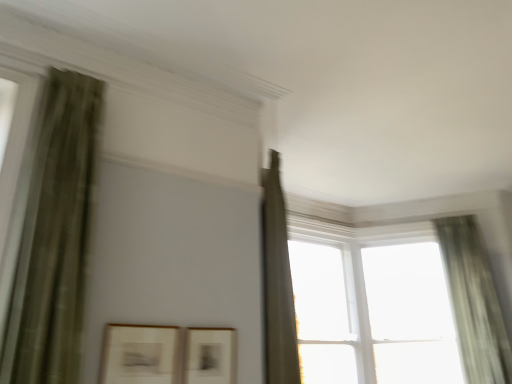
What do you see at coordinates (410, 314) in the screenshot?
I see `transparent glass window at upper right, which is the second window from left to right` at bounding box center [410, 314].

Find the location of a particular element. This screenshot has width=512, height=384. green sheer curtain at right, which is the 1th curtain from right to left is located at coordinates (474, 301).

In order to face green sheer curtain at right, the 2th curtain from the front, should I rotate leftwards or rightwards?

Turn right approximately 27.333 degrees to face it.

I want to click on transparent glass window at upper right, marked as the 1th window in a right-to-left arrangement, so click(x=475, y=300).

What do you see at coordinates (168, 355) in the screenshot? I see `matte white picture frame at lower left, marked as the 1th picture frame in a left-to-right arrangement` at bounding box center [168, 355].

In order to face matte black picture frame at center, the 2th picture frame when ordered from left to right, should I rotate leftwards or rightwards?

You should look left and rotate roughly 5.813 degrees.

Locate an element on the screen. transparent glass window at upper right, the 2th window in the right-to-left sequence is located at coordinates (410, 314).

Is green sheer curtain at right, arranged as the 2th curtain when viewed from the left, aimed at green textured curtain at left, the 1th curtain positioned from the front?

No, green sheer curtain at right, arranged as the 2th curtain when viewed from the left, is not aimed at green textured curtain at left, the 1th curtain positioned from the front.

Is green sheer curtain at right, arranged as the 2th curtain when viewed from the left, next to green textured curtain at left, the 1th curtain positioned from the front?

green sheer curtain at right, arranged as the 2th curtain when viewed from the left, is not next to green textured curtain at left, the 1th curtain positioned from the front, and they're not touching.

From the image's perspective, does green sheer curtain at right, which appears as the first curtain when viewed from the back, appear lower than green textured curtain at left, which is counted as the first curtain, starting from the left?

Yes, from the image's perspective, green sheer curtain at right, which appears as the first curtain when viewed from the back, is beneath green textured curtain at left, which is counted as the first curtain, starting from the left.

Which is behind, green sheer curtain at right, arranged as the 2th curtain when viewed from the left, or green textured curtain at left, the 1th curtain positioned from the front?

green sheer curtain at right, arranged as the 2th curtain when viewed from the left, is further away from the camera.

Is matte white picture frame at lower left, the 2th picture frame from the right, wider or thinner than transparent glass window at upper right, marked as the 1th window in a right-to-left arrangement?

Considering their sizes, matte white picture frame at lower left, the 2th picture frame from the right, looks slimmer than transparent glass window at upper right, marked as the 1th window in a right-to-left arrangement.

Measure the distance between matte white picture frame at lower left, marked as the 1th picture frame in a left-to-right arrangement, and transparent glass window at upper right, the 3th window in the left-to-right sequence.

matte white picture frame at lower left, marked as the 1th picture frame in a left-to-right arrangement, is 3.06 meters away from transparent glass window at upper right, the 3th window in the left-to-right sequence.

Is point (224, 347) farther from camera compared to point (278, 315)?

No, it is in front of (278, 315).

Which object is further away from the camera taking this photo, matte white picture frame at lower left, the 2th picture frame from the right, or transparent glass window at upper right, the 3th window in the left-to-right sequence?

transparent glass window at upper right, the 3th window in the left-to-right sequence, is further away from the camera.

Is matte white picture frame at lower left, marked as the 1th picture frame in a left-to-right arrangement, inside matte black picture frame at center, which ranks as the 1th picture frame in right-to-left order?

No, matte white picture frame at lower left, marked as the 1th picture frame in a left-to-right arrangement, is located outside of matte black picture frame at center, which ranks as the 1th picture frame in right-to-left order.

From a real-world perspective, between matte black picture frame at center, which ranks as the 1th picture frame in right-to-left order, and matte white picture frame at lower left, marked as the 1th picture frame in a left-to-right arrangement, who is vertically higher?

From a 3D spatial view, matte white picture frame at lower left, marked as the 1th picture frame in a left-to-right arrangement, is above.

Does matte black picture frame at center, which ranks as the 1th picture frame in right-to-left order, appear on the left side of matte white picture frame at lower left, marked as the 1th picture frame in a left-to-right arrangement?

No, matte black picture frame at center, which ranks as the 1th picture frame in right-to-left order, is not to the left of matte white picture frame at lower left, marked as the 1th picture frame in a left-to-right arrangement.

From the image's perspective, between matte black picture frame at center, the 2th picture frame when ordered from left to right, and matte white picture frame at lower left, the 2th picture frame from the right, which one is located above?

From the image's view, matte white picture frame at lower left, the 2th picture frame from the right, is above.

From the image's perspective, relative to transparent glass window at upper right, marked as the 1th window in a right-to-left arrangement, is transparent glass window at upper right, which is the second window from left to right, above or below?

From the image's perspective, transparent glass window at upper right, which is the second window from left to right, appears below transparent glass window at upper right, marked as the 1th window in a right-to-left arrangement.

Which of these two, transparent glass window at upper right, the 2th window in the right-to-left sequence, or transparent glass window at upper right, the 3th window in the left-to-right sequence, stands shorter?

With less height is transparent glass window at upper right, the 2th window in the right-to-left sequence.

Is transparent glass window at upper right, the 3th window in the left-to-right sequence, inside transparent glass window at upper right, the 2th window in the right-to-left sequence?

Absolutely, transparent glass window at upper right, the 3th window in the left-to-right sequence, is inside transparent glass window at upper right, the 2th window in the right-to-left sequence.

Based on the photo, relative to white glass window at center, the third window when ordered from right to left, is matte white picture frame at lower left, the 2th picture frame from the right, in front or behind?

In the image, matte white picture frame at lower left, the 2th picture frame from the right, appears in front of white glass window at center, the third window when ordered from right to left.

From a real-world perspective, which is physically below, matte white picture frame at lower left, marked as the 1th picture frame in a left-to-right arrangement, or white glass window at center, which is counted as the first window, starting from the left?

From a 3D spatial view, matte white picture frame at lower left, marked as the 1th picture frame in a left-to-right arrangement, is below.

Is matte white picture frame at lower left, the 2th picture frame from the right, turned away from white glass window at center, which is counted as the first window, starting from the left?

No, matte white picture frame at lower left, the 2th picture frame from the right, is not facing the opposite direction of white glass window at center, which is counted as the first window, starting from the left.

How different are the orientations of transparent glass window at upper right, the 3th window in the left-to-right sequence, and transparent glass window at upper right, which is the second window from left to right, in degrees?

They differ by 1.1 degrees in their facing directions.

Who is more distant, transparent glass window at upper right, marked as the 1th window in a right-to-left arrangement, or transparent glass window at upper right, which is the second window from left to right?

transparent glass window at upper right, which is the second window from left to right, is further away from the camera.

In the scene shown: From the image's perspective, which is below, transparent glass window at upper right, the 3th window in the left-to-right sequence, or transparent glass window at upper right, which is the second window from left to right?

From the image's view, transparent glass window at upper right, which is the second window from left to right, is below.

Is transparent glass window at upper right, marked as the 1th window in a right-to-left arrangement, wider than transparent glass window at upper right, the 2th window in the right-to-left sequence?

No.

Is green textured curtain at left, which is counted as the 2th curtain, starting from the back, thinner than transparent glass window at upper right, marked as the 1th window in a right-to-left arrangement?

No.

Which object is closer to the camera, green textured curtain at left, which is counted as the first curtain, starting from the left, or transparent glass window at upper right, the 3th window in the left-to-right sequence?

green textured curtain at left, which is counted as the first curtain, starting from the left, is more forward.

Is green textured curtain at left, which is the 2th curtain from right to left, spatially inside transparent glass window at upper right, the 3th window in the left-to-right sequence, or outside of it?

green textured curtain at left, which is the 2th curtain from right to left, exists outside the volume of transparent glass window at upper right, the 3th window in the left-to-right sequence.

Which point is more forward, (59, 185) or (272, 278)?

Point (59, 185)

Image resolution: width=512 pixels, height=384 pixels. There is a green sheer curtain at right, arranged as the 2th curtain when viewed from the left. What are the coordinates of `curtain above it (from a real-world perspective)` in the screenshot? It's located at (54, 236).

From the transparent glass window at upper right, marked as the 1th window in a right-to-left arrangement, count the 2nd picture frame to the left and point to it. Please provide its 2D coordinates.

[(168, 355)]

Looking at the image, which one is located further to green textured curtain at left, which is counted as the first curtain, starting from the left, white glass window at center, the third window when ordered from right to left, or matte white picture frame at lower left, marked as the 1th picture frame in a left-to-right arrangement?

Among the two, white glass window at center, the third window when ordered from right to left, is located further to green textured curtain at left, which is counted as the first curtain, starting from the left.

Considering their positions, is matte black picture frame at center, which ranks as the 1th picture frame in right-to-left order, positioned further to white glass window at center, which is counted as the first window, starting from the left, than transparent glass window at upper right, the 2th window in the right-to-left sequence?

matte black picture frame at center, which ranks as the 1th picture frame in right-to-left order.

From the image, which object appears to be nearer to transparent glass window at upper right, the 2th window in the right-to-left sequence, transparent glass window at upper right, the 3th window in the left-to-right sequence, or matte white picture frame at lower left, marked as the 1th picture frame in a left-to-right arrangement?

transparent glass window at upper right, the 3th window in the left-to-right sequence, is closer to transparent glass window at upper right, the 2th window in the right-to-left sequence.

Looking at the image, which one is located further to green sheer curtain at right, arranged as the 2th curtain when viewed from the left, transparent glass window at upper right, which is the second window from left to right, or transparent glass window at upper right, the 3th window in the left-to-right sequence?

transparent glass window at upper right, which is the second window from left to right.

When comparing their distances from matte black picture frame at center, which ranks as the 1th picture frame in right-to-left order, does matte white picture frame at lower left, the 2th picture frame from the right, or white glass window at center, which is counted as the first window, starting from the left, seem closer?

matte white picture frame at lower left, the 2th picture frame from the right, is positioned closer to the anchor matte black picture frame at center, which ranks as the 1th picture frame in right-to-left order.

From the image, which object appears to be farther from matte black picture frame at center, which ranks as the 1th picture frame in right-to-left order, green textured curtain at left, which is counted as the 2th curtain, starting from the back, or transparent glass window at upper right, the 2th window in the right-to-left sequence?

Based on the image, transparent glass window at upper right, the 2th window in the right-to-left sequence, appears to be further to matte black picture frame at center, which ranks as the 1th picture frame in right-to-left order.

Considering their positions, is green textured curtain at left, which is counted as the first curtain, starting from the left, positioned closer to green sheer curtain at right, which appears as the first curtain when viewed from the back, than transparent glass window at upper right, the 2th window in the right-to-left sequence?

transparent glass window at upper right, the 2th window in the right-to-left sequence, lies closer to green sheer curtain at right, which appears as the first curtain when viewed from the back, than the other object.

Estimate the real-world distances between objects in this image. Which object is further from white glass window at center, which is counted as the first window, starting from the left, transparent glass window at upper right, marked as the 1th window in a right-to-left arrangement, or green sheer curtain at right, the 2th curtain from the front?

transparent glass window at upper right, marked as the 1th window in a right-to-left arrangement.

Where is `picture frame located between matte white picture frame at lower left, marked as the 1th picture frame in a left-to-right arrangement, and transparent glass window at upper right, the 2th window in the right-to-left sequence, in the depth direction`? The height and width of the screenshot is (384, 512). picture frame located between matte white picture frame at lower left, marked as the 1th picture frame in a left-to-right arrangement, and transparent glass window at upper right, the 2th window in the right-to-left sequence, in the depth direction is located at coordinates (210, 355).

I want to click on window between transparent glass window at upper right, the 2th window in the right-to-left sequence, and green sheer curtain at right, which is the 1th curtain from right to left, from left to right, so click(475, 300).

Image resolution: width=512 pixels, height=384 pixels. What are the coordinates of `picture frame between green textured curtain at left, the 1th curtain positioned from the front, and matte black picture frame at center, which ranks as the 1th picture frame in right-to-left order, in the vertical direction` in the screenshot? It's located at (168, 355).

Find the location of `picture frame between matte white picture frame at lower left, marked as the 1th picture frame in a left-to-right arrangement, and green sheer curtain at right, which appears as the first curtain when viewed from the back`. picture frame between matte white picture frame at lower left, marked as the 1th picture frame in a left-to-right arrangement, and green sheer curtain at right, which appears as the first curtain when viewed from the back is located at coordinates (210, 355).